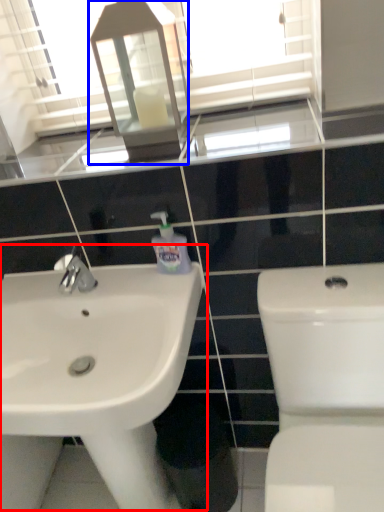
Question: Which point is further to the camera, sink (highlighted by a red box) or medicine cabinet (highlighted by a blue box)?

Choices:
 (A) sink
 (B) medicine cabinet

Answer: (B)